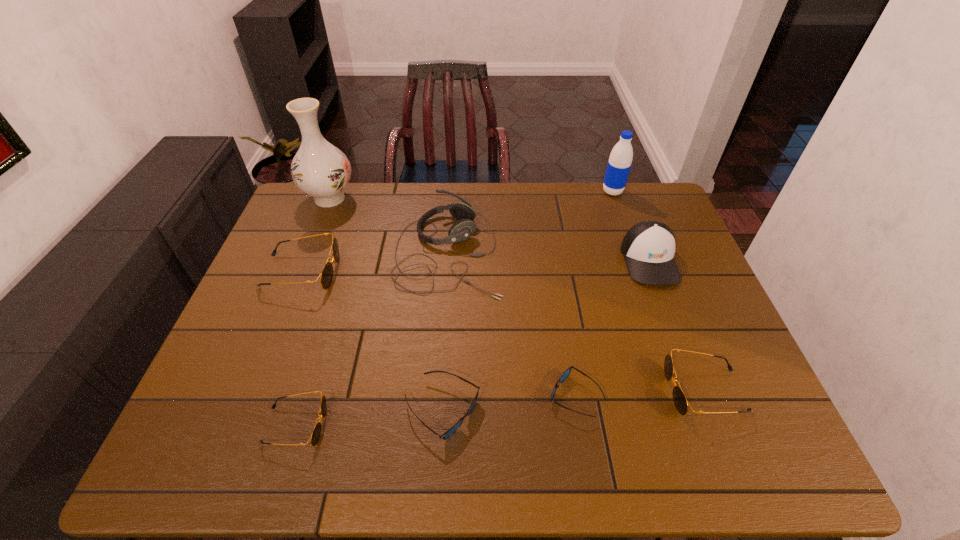
Locate an element on the screen. This screenshot has width=960, height=540. the third sunglasses from left to right is located at coordinates (453, 429).

Where is `the smallest black sunglasses`? the smallest black sunglasses is located at coordinates (316, 432).

I want to click on the shortest object, so click(567, 372).

Identify the location of the second sunglasses from right to left. (567, 372).

I want to click on vacant space located 0.110m on the right of the tallest object, so click(x=389, y=198).

I want to click on free point located 0.400m on the left of the blue water bottle, so click(x=489, y=192).

Find the location of `vacant area situated 0.270m on the front panel of the gray cap`. vacant area situated 0.270m on the front panel of the gray cap is located at coordinates tap(692, 372).

Where is `vacant position located on the outer surface of the headset`? The image size is (960, 540). vacant position located on the outer surface of the headset is located at coordinates (560, 252).

You are a GUI agent. You are given a task and a screenshot of the screen. Output one action in this format:
    pyautogui.click(x=<x>, y=<y>)
    Task: Click on the free space located 0.230m on the front-facing side of the farthest sunglasses
    The image size is (960, 540).
    Given the screenshot: What is the action you would take?
    pyautogui.click(x=417, y=272)

Where is `vacant space positioned 0.350m on the front-facing side of the rightmost black sunglasses`? vacant space positioned 0.350m on the front-facing side of the rightmost black sunglasses is located at coordinates (516, 390).